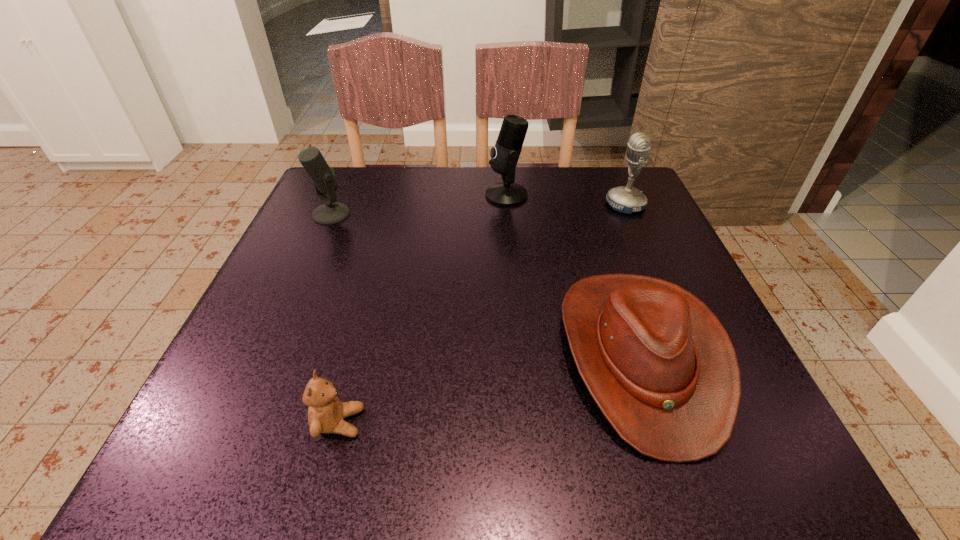
I want to click on blank region between the third object from left to right and the teddy bear, so click(x=422, y=309).

Where is `vacant area that lies between the second microphone from left to right and the cowboy hat`? The image size is (960, 540). vacant area that lies between the second microphone from left to right and the cowboy hat is located at coordinates (574, 275).

You are a GUI agent. You are given a task and a screenshot of the screen. Output one action in this format:
    pyautogui.click(x=<x>, y=<y>)
    Task: Click on the free space between the cowboy hat and the leftmost object
    The width and height of the screenshot is (960, 540).
    Given the screenshot: What is the action you would take?
    pyautogui.click(x=487, y=285)

This screenshot has width=960, height=540. In order to click on free space between the leftmost object and the rightmost microphone in this screenshot , I will do `click(478, 210)`.

Identify the location of vacant region between the rightmost microphone and the third object from right to left. (565, 200).

Find the location of `free space between the second microphone from left to right and the rightmost microphone`. free space between the second microphone from left to right and the rightmost microphone is located at coordinates (565, 200).

This screenshot has width=960, height=540. I want to click on free area in between the cowboy hat and the second microphone from left to right, so click(574, 275).

The width and height of the screenshot is (960, 540). I want to click on free area in between the second microphone from left to right and the fourth object from right to left, so click(422, 309).

I want to click on object that is the fourth closest to the second microphone from left to right, so tap(326, 412).

Find the location of `object that is the fourth closest one to the rightmost microphone`. object that is the fourth closest one to the rightmost microphone is located at coordinates pos(326,412).